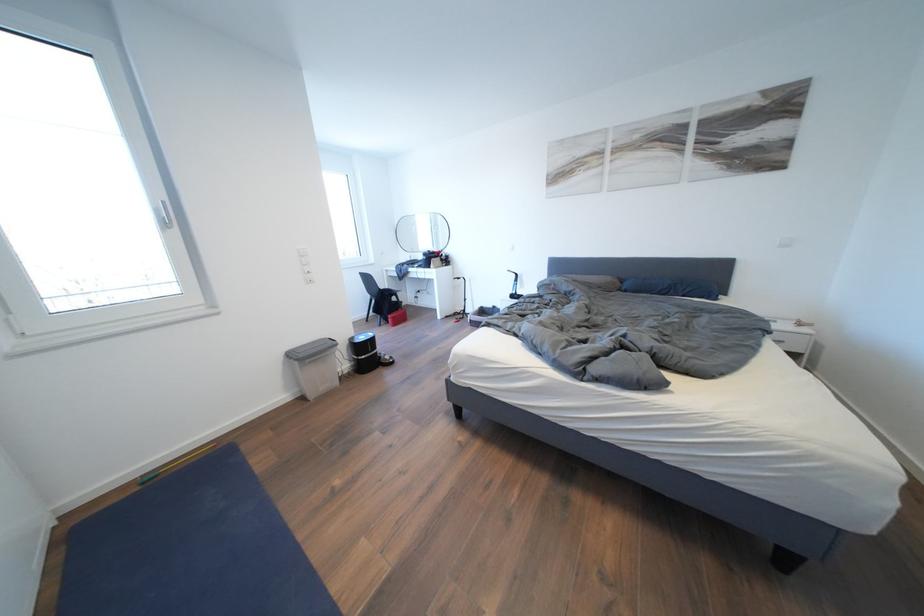
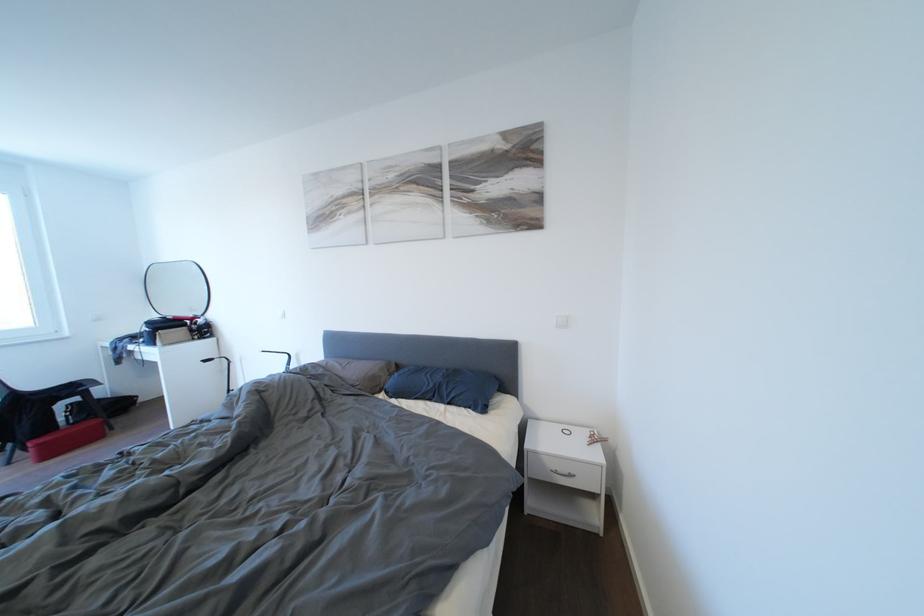
The point at (400,323) is marked in the first image. Where is the corresponding point in the second image?

(46, 450)